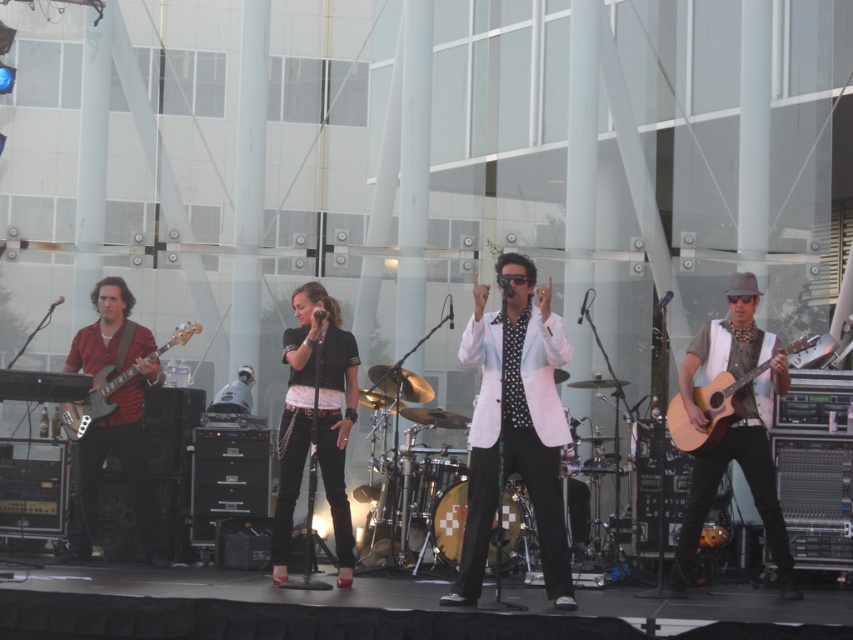
Question: Can you confirm if black leather jacket at center is bigger than matte black bass at left?

Choices:
 (A) no
 (B) yes

Answer: (B)

Question: Which of the following is the farthest from the observer?

Choices:
 (A) (x=786, y=563)
 (B) (x=148, y=358)
 (C) (x=77, y=460)
 (D) (x=741, y=380)

Answer: (C)

Question: Among these points, which one is nearest to the camera?

Choices:
 (A) (738, 388)
 (B) (473, 566)
 (C) (297, 371)
 (D) (82, 356)

Answer: (B)

Question: Which object is the farthest from the white glossy jacket at center?

Choices:
 (A) matte black bass at left
 (B) acoustic wood guitar at right
 (C) light brown acoustic guitar at right

Answer: (A)

Question: Does white polka dot shirt at center appear under black leather jacket at center?

Choices:
 (A) no
 (B) yes

Answer: (A)

Question: Is black leather jacket at center to the left of matte red guitar at left from the viewer's perspective?

Choices:
 (A) yes
 (B) no

Answer: (B)